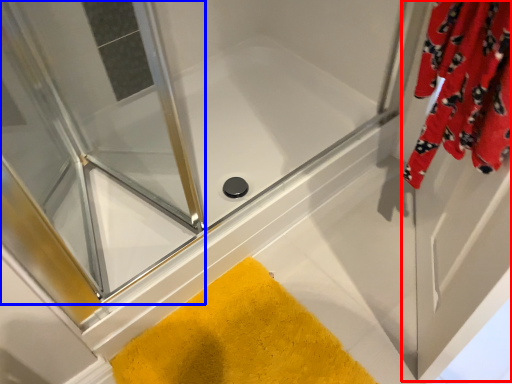
Question: Which of the following is the farthest to the observer, screen door (highlighted by a red box) or screen door (highlighted by a blue box)?

Choices:
 (A) screen door
 (B) screen door

Answer: (B)